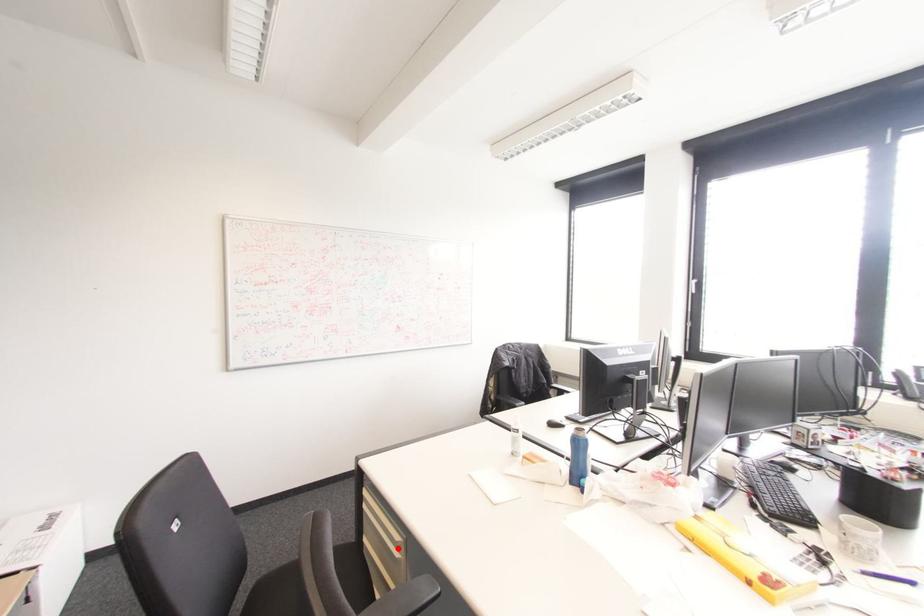
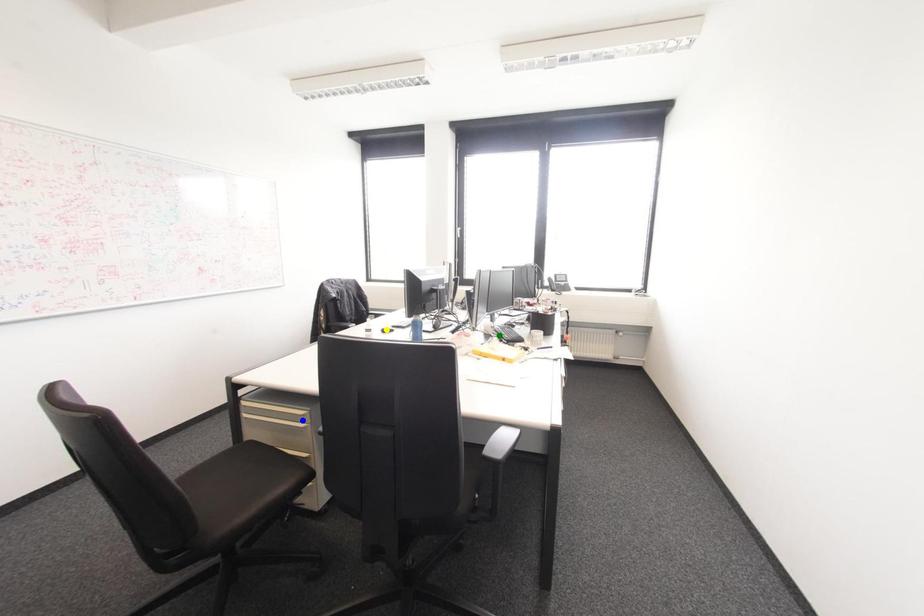
Question: I am providing you with two images of the same scene from different viewpoints. A red point is marked on the first image. You are given multiple points on the second image. Which point in image 2 is actually the same real-world point as the red point in image 1?

Choices:
 (A) green point
 (B) yellow point
 (C) blue point

Answer: (C)